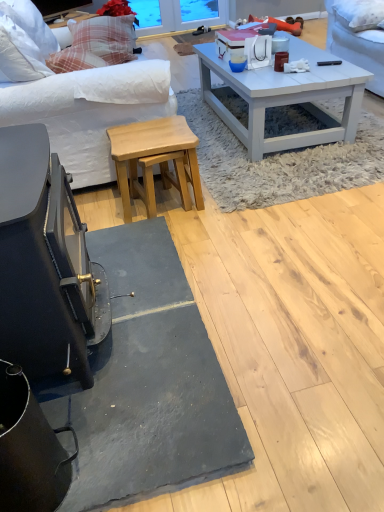
Find the location of a particular element. free spot in front of matte brown coffee cup at center, the 1th coffee cup viewed from the right is located at coordinates (297, 81).